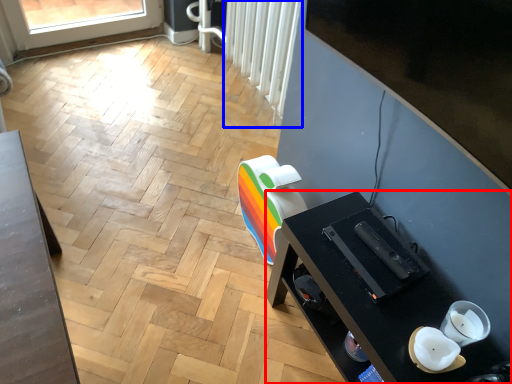
Question: Which object appears farthest to the camera in this image, desk (highlighted by a red box) or radiator (highlighted by a blue box)?

Choices:
 (A) desk
 (B) radiator

Answer: (B)